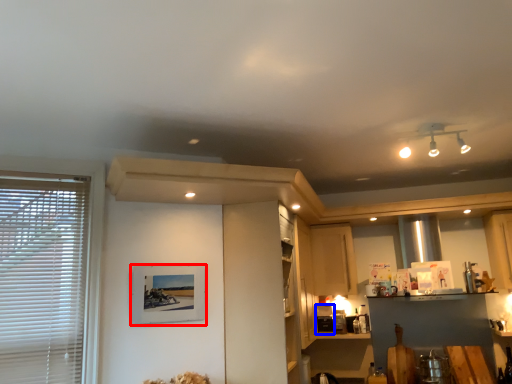
Question: Among these objects, which one is nearest to the camera, picture frame (highlighted by a red box) or appliance (highlighted by a blue box)?

Choices:
 (A) picture frame
 (B) appliance

Answer: (A)